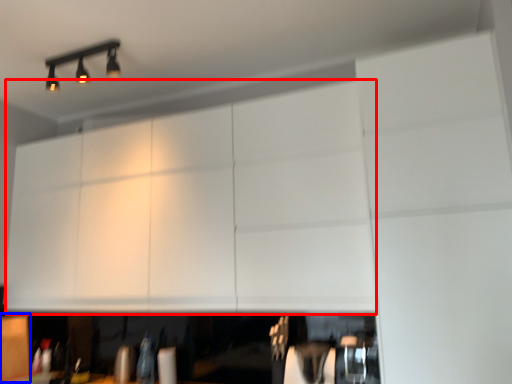
Question: Which object appears farthest to the camera in this image, cabinetry (highlighted by a red box) or cabinetry (highlighted by a blue box)?

Choices:
 (A) cabinetry
 (B) cabinetry

Answer: (B)